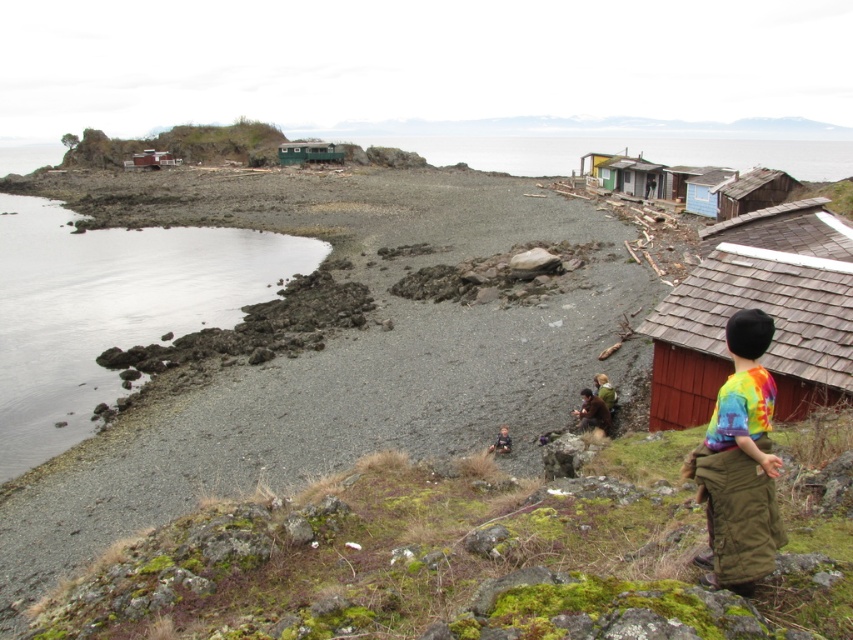
Can you confirm if blue wooden hut at upper right is taller than green weathered wood hut at center?

Indeed, blue wooden hut at upper right has a greater height compared to green weathered wood hut at center.

Between point (705, 204) and point (325, 145), which one is positioned in front?

Point (705, 204)

Identify the location of blue wooden hut at upper right. (706, 189).

Between wooden shingles hut at right and blue wooden hut at upper right, which one is positioned higher?

Positioned higher is blue wooden hut at upper right.

Can you confirm if wooden shingles hut at right is positioned to the left of blue wooden hut at upper right?

Yes, wooden shingles hut at right is to the left of blue wooden hut at upper right.

The width and height of the screenshot is (853, 640). Describe the element at coordinates (759, 308) in the screenshot. I see `wooden shingles hut at right` at that location.

Find the location of a particular element. The width and height of the screenshot is (853, 640). wooden shingles hut at right is located at coordinates (759, 308).

Is wooden shingles hut at right positioned at the back of green fabric jacket at center?

No, wooden shingles hut at right is in front of green fabric jacket at center.

Who is more distant from viewer, (715, 243) or (612, 406)?

The point (715, 243) is more distant.

This screenshot has width=853, height=640. What are the coordinates of `wooden shingles hut at right` in the screenshot? It's located at (759, 308).